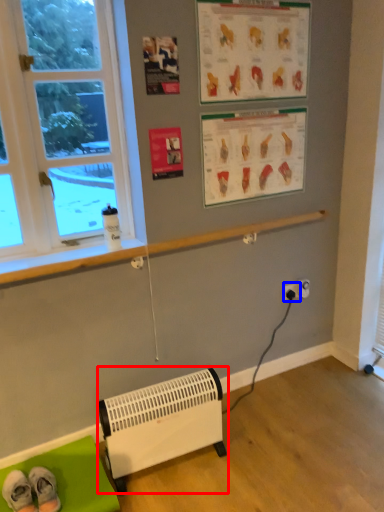
Question: Which object is closer to the camera taking this photo, heater (highlighted by a red box) or electric outlet (highlighted by a blue box)?

Choices:
 (A) heater
 (B) electric outlet

Answer: (A)